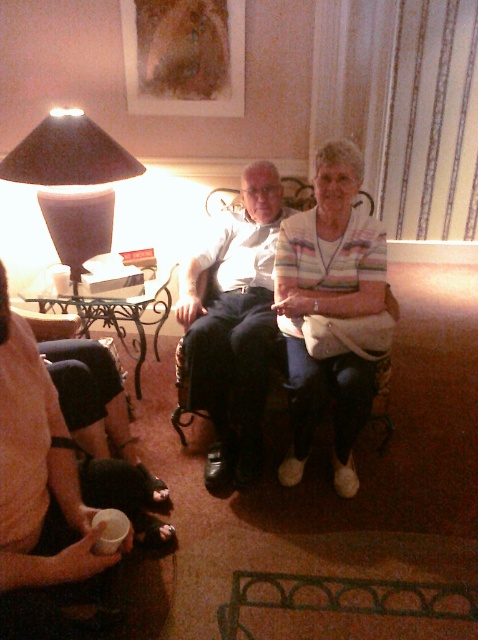
Question: Observing the image, what is the correct spatial positioning of light brown leather chair at center in reference to matte black lampshade at left?

Choices:
 (A) right
 (B) left

Answer: (A)

Question: Which object is farther from the camera taking this photo?

Choices:
 (A) matte black lampshade at left
 (B) white striped sweater at center

Answer: (A)

Question: Can you confirm if white striped sweater at center is thinner than matte black lampshade at left?

Choices:
 (A) no
 (B) yes

Answer: (B)

Question: Which is farther from the white striped sweater at center?

Choices:
 (A) light brown leather chair at center
 (B) matte black lampshade at left

Answer: (B)

Question: Which point is farther from the camera taking this photo?

Choices:
 (A) (336, 412)
 (B) (254, 227)
 (C) (138, 173)

Answer: (C)

Question: In this image, where is light brown leather chair at center located relative to matte black lampshade at left?

Choices:
 (A) above
 (B) below

Answer: (B)